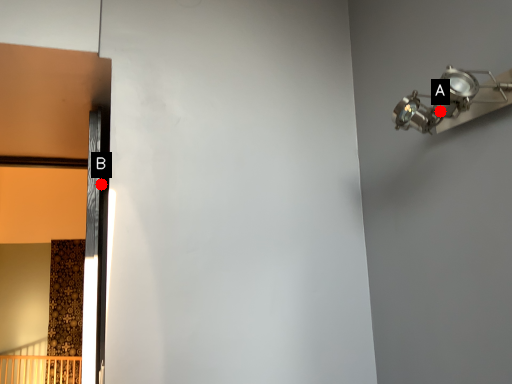
Question: Two points are circled on the image, labeled by A and B beside each circle. Which point is farther from the camera taking this photo?

Choices:
 (A) A is further
 (B) B is further

Answer: (B)